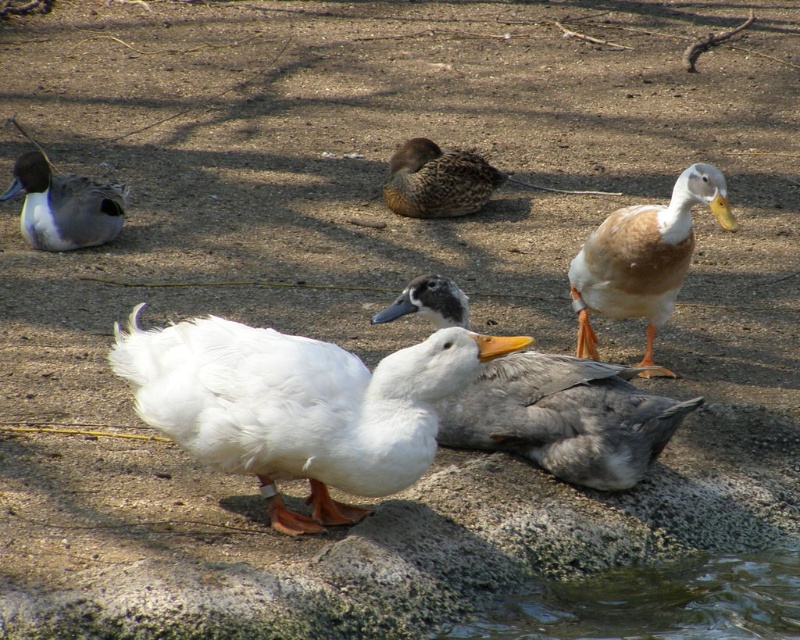
You are a photographer trying to capture a closeup of the white duck with orange webbed feet standing on a rocky surface. You are positioned at point A, which is at coordinates point (649, 310). There is an obstruction at point B, which is at coordinates point (50, 228). Will the obstruction at point B block your view of the white duck?

Point (649, 310) is closer to the camera than point (50, 228), so the obstruction at point (50, 228) will not block your view of the white duck because it is further away from the camera.

You are standing at the point marked as point (641,241) in the image. The distance from you to the viewer is 4.43 meters. You want to throw a small pebble to hit a duck in the scene. Which duck is closest to you?

The closest duck to point (641,241) would be the white duck with orange webbed feet standing on a rocky surface facing slightly towards the right side of the frame, since it is in the foreground and the distance from the viewer is 4.43 meters.